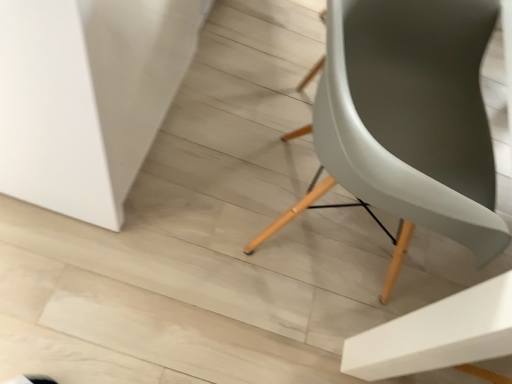
Find the location of `vacant space that is to the left of matte gray chair at center`. vacant space that is to the left of matte gray chair at center is located at coordinates (186, 172).